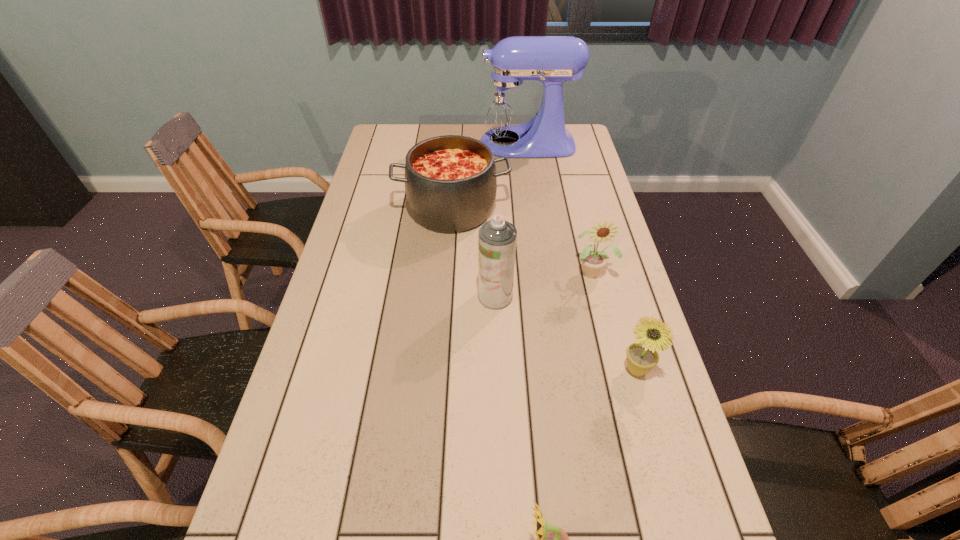
You are a GUI agent. You are given a task and a screenshot of the screen. Output one action in this format:
    pyautogui.click(x=<x>, y=<y>)
    Task: Click on the vacant point located 0.330m on the front-facing side of the farthest sunflower
    The width and height of the screenshot is (960, 540).
    Given the screenshot: What is the action you would take?
    pyautogui.click(x=622, y=389)

You are a GUI agent. You are given a task and a screenshot of the screen. Output one action in this format:
    pyautogui.click(x=<x>, y=<y>)
    Task: Click on the free space located on the back of the casserole
    
    Given the screenshot: What is the action you would take?
    pyautogui.click(x=456, y=166)

Locate an element on the screen. This screenshot has height=540, width=960. free spot located on the face of the second nearest sunflower is located at coordinates (658, 447).

At what (x,y) coordinates should I click in order to perform the action: click on object that is at the far edge. Please return your answer as a coordinate pair (x, y). The height and width of the screenshot is (540, 960). Looking at the image, I should click on (506, 105).

Locate an element on the screen. object located at the left edge is located at coordinates (450, 181).

This screenshot has width=960, height=540. What are the coordinates of `mixer located in the right edge section of the desktop` in the screenshot? It's located at (506, 105).

This screenshot has height=540, width=960. In order to click on object that is at the far right corner in this screenshot , I will do `click(506, 105)`.

At what (x,y) coordinates should I click in order to perform the action: click on free space at the far edge of the desktop. Please return your answer as a coordinate pair (x, y). The height and width of the screenshot is (540, 960). Looking at the image, I should click on (454, 132).

What are the coordinates of `vacant space at the left edge` in the screenshot? It's located at (386, 231).

Where is `free location at the right edge`? This screenshot has height=540, width=960. free location at the right edge is located at coordinates point(621,472).